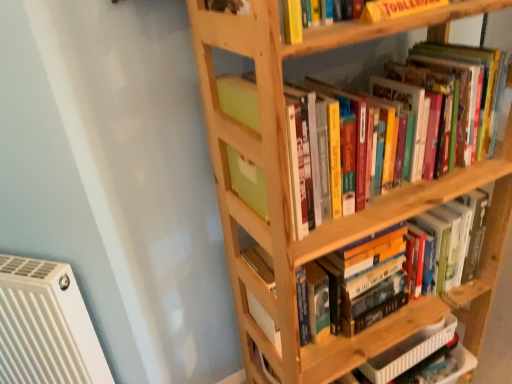
Question: Can you confirm if hardcover books at center, acting as the 2th book starting from the bottom, is positioned to the left of white plastic radiator at lower left?

Choices:
 (A) yes
 (B) no

Answer: (B)

Question: Considering the relative sizes of hardcover books at center, the second book viewed from the top, and white plastic radiator at lower left in the image provided, is hardcover books at center, the second book viewed from the top, shorter than white plastic radiator at lower left?

Choices:
 (A) no
 (B) yes

Answer: (B)

Question: Can you confirm if hardcover books at center, acting as the 2th book starting from the bottom, is taller than white plastic radiator at lower left?

Choices:
 (A) no
 (B) yes

Answer: (A)

Question: From a real-world perspective, is hardcover books at center, acting as the 2th book starting from the bottom, under white plastic radiator at lower left?

Choices:
 (A) yes
 (B) no

Answer: (B)

Question: Would you say white plastic radiator at lower left is part of hardcover books at center, acting as the 2th book starting from the bottom,'s contents?

Choices:
 (A) yes
 (B) no

Answer: (B)

Question: From the image's perspective, is hardcover books at center, acting as the 2th book starting from the bottom, on top of white plastic radiator at lower left?

Choices:
 (A) yes
 (B) no

Answer: (A)

Question: Does wooden bookshelf at center, the 1th book when ordered from top to bottom, have a smaller size compared to white plastic radiator at lower left?

Choices:
 (A) no
 (B) yes

Answer: (B)

Question: Can you confirm if wooden bookshelf at center, the 1th book when ordered from top to bottom, is wider than white plastic radiator at lower left?

Choices:
 (A) no
 (B) yes

Answer: (B)

Question: Is wooden bookshelf at center, the 1th book when ordered from top to bottom, located outside white plastic radiator at lower left?

Choices:
 (A) yes
 (B) no

Answer: (A)

Question: Does wooden bookshelf at center, the 1th book when ordered from top to bottom, have a larger size compared to white plastic radiator at lower left?

Choices:
 (A) yes
 (B) no

Answer: (B)

Question: Does wooden bookshelf at center, which ranks as the third book in bottom-to-top order, turn towards white plastic radiator at lower left?

Choices:
 (A) yes
 (B) no

Answer: (B)

Question: Is the depth of wooden bookshelf at center, which ranks as the third book in bottom-to-top order, less than that of white plastic radiator at lower left?

Choices:
 (A) yes
 (B) no

Answer: (A)

Question: Is yellow cardboard toblerone at upper center a part of hardcover book at lower right, the 1th book ordered from the bottom?

Choices:
 (A) no
 (B) yes

Answer: (A)